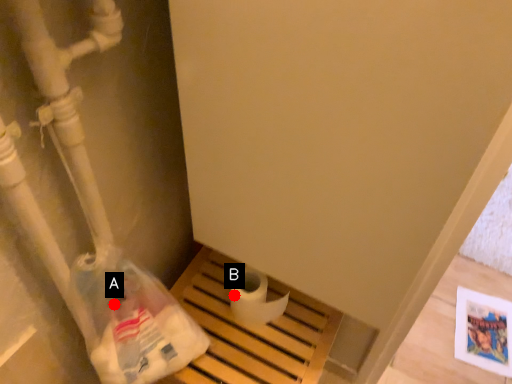
Question: Two points are circled on the image, labeled by A and B beside each circle. Which point is closer to the camera taking this photo?

Choices:
 (A) A is closer
 (B) B is closer

Answer: (A)